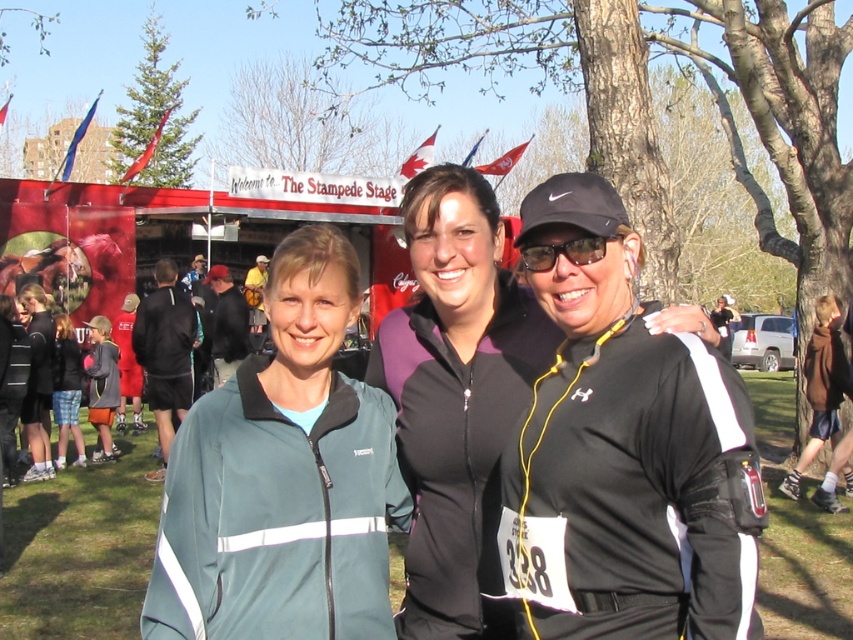
You are a photographer at the event and want to ensure all participants are visible in the photo. The dark gray jacket at left and the dark gray hoodie at center are both in your frame. Which one appears smaller in the photo?

The dark gray jacket at left appears smaller in the photo because it has a smaller size compared to the dark gray hoodie at center.

You are a photographer standing at the edge of the grassy area where the three women are posing. You want to take a photo that includes both the dark gray jacket at left and the dark gray hoodie at center. Given that your camera has a maximum focus range of 8 meters, will you be able to capture both subjects in focus without moving closer?

The dark gray jacket at left is 8.77 meters from the dark gray hoodie at center. Since the distance between them exceeds the camera maximum focus range of 8 meters, you will not be able to capture both subjects in focus without moving closer.

You are a photographer trying to capture the perfect shot of the black matte jacket at center. Based on the coordinates given, where should you position your camera to ensure the jacket is centered in the frame?

The black matte jacket at center is located at coordinates point (457, 397), so positioning the camera to align the center of the frame with these coordinates will ensure the jacket is centered in the shot.